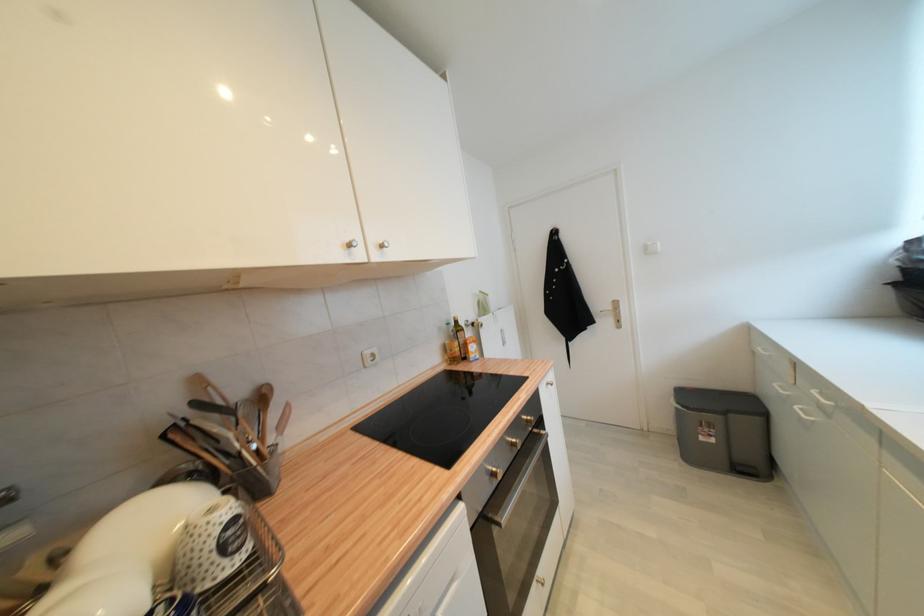
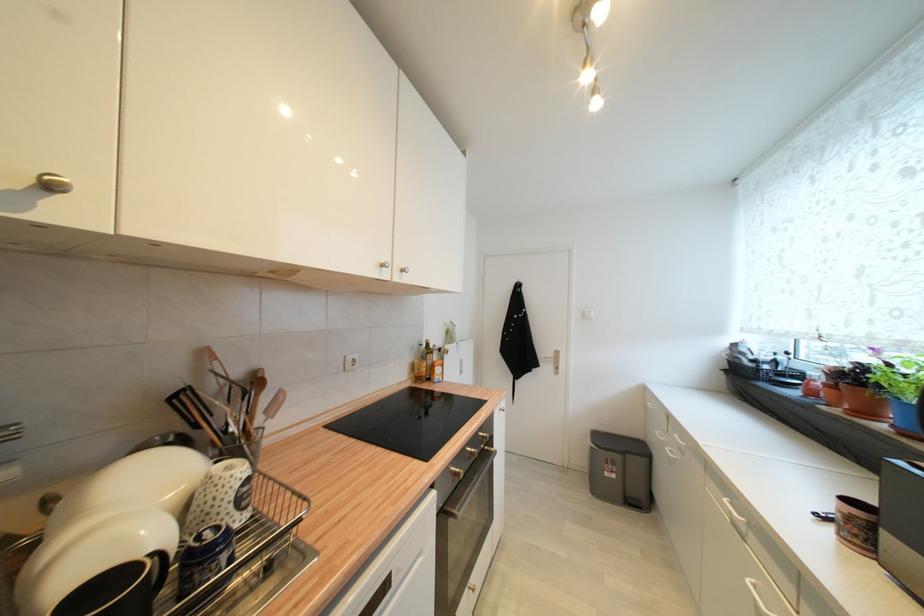
Which direction would the cameraman need to move to produce the second image?

The cameraman walked toward left, backward.